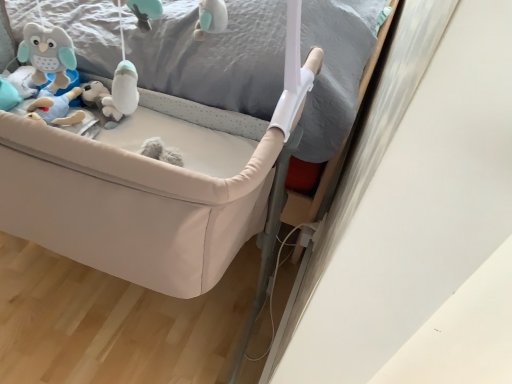
Question: From a real-world perspective, is beige fabric infant bed at center over beige fabric bed frame at center?

Choices:
 (A) no
 (B) yes

Answer: (A)

Question: From the image's perspective, is beige fabric infant bed at center under beige fabric bed frame at center?

Choices:
 (A) no
 (B) yes

Answer: (B)

Question: Is beige fabric infant bed at center oriented towards beige fabric bed frame at center?

Choices:
 (A) yes
 (B) no

Answer: (B)

Question: Is beige fabric infant bed at center shorter than beige fabric bed frame at center?

Choices:
 (A) no
 (B) yes

Answer: (A)

Question: Is the position of beige fabric infant bed at center less distant than that of beige fabric bed frame at center?

Choices:
 (A) yes
 (B) no

Answer: (B)

Question: Are beige fabric infant bed at center and beige fabric bed frame at center beside each other?

Choices:
 (A) no
 (B) yes

Answer: (A)

Question: Considering the relative positions of beige fabric bed frame at center and beige fabric infant bed at center in the image provided, is beige fabric bed frame at center to the right of beige fabric infant bed at center from the viewer's perspective?

Choices:
 (A) yes
 (B) no

Answer: (A)

Question: Can beige fabric infant bed at center be found inside beige fabric bed frame at center?

Choices:
 (A) yes
 (B) no

Answer: (B)

Question: Is beige fabric bed frame at center shorter than beige fabric infant bed at center?

Choices:
 (A) yes
 (B) no

Answer: (A)

Question: Does beige fabric bed frame at center appear on the left side of beige fabric infant bed at center?

Choices:
 (A) no
 (B) yes

Answer: (A)

Question: Does beige fabric bed frame at center have a smaller size compared to beige fabric infant bed at center?

Choices:
 (A) yes
 (B) no

Answer: (A)

Question: From the image's perspective, is beige fabric bed frame at center over beige fabric infant bed at center?

Choices:
 (A) yes
 (B) no

Answer: (A)

Question: In terms of size, does beige fabric infant bed at center appear bigger or smaller than beige fabric bed frame at center?

Choices:
 (A) big
 (B) small

Answer: (A)